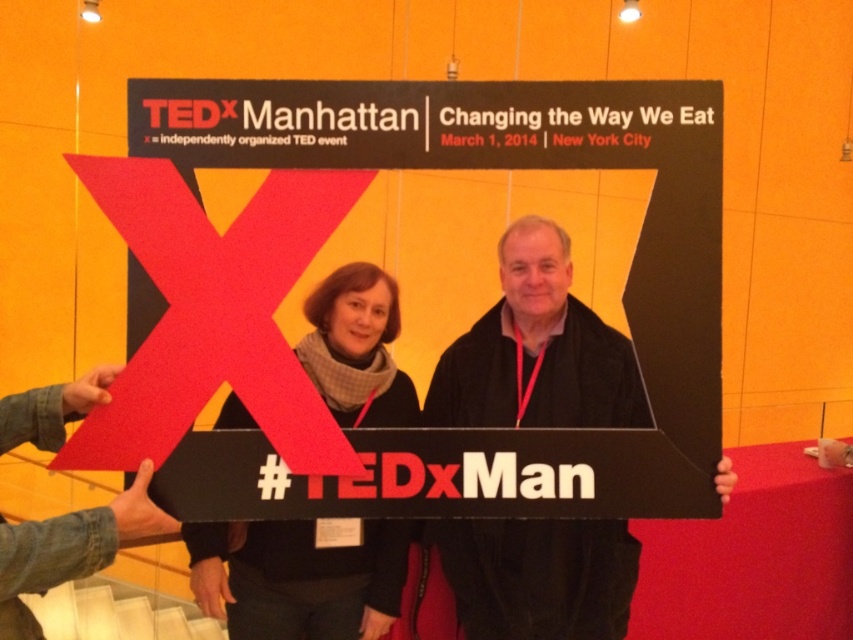
Can you confirm if black matte sign at center is bigger than matte black scarf at center?

Yes, black matte sign at center is bigger than matte black scarf at center.

Is point (503, 531) more distant than point (367, 404)?

That is True.

Where is `black matte sign at center`? black matte sign at center is located at coordinates (537, 349).